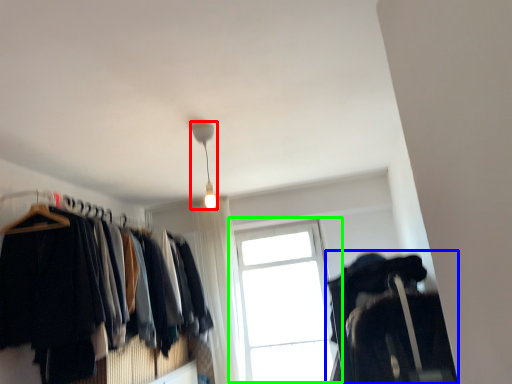
Question: Based on their relative distances, which object is nearer to lamp (highlighted by a red box)? Choose from closet (highlighted by a blue box) and window (highlighted by a green box).

Choices:
 (A) closet
 (B) window

Answer: (A)